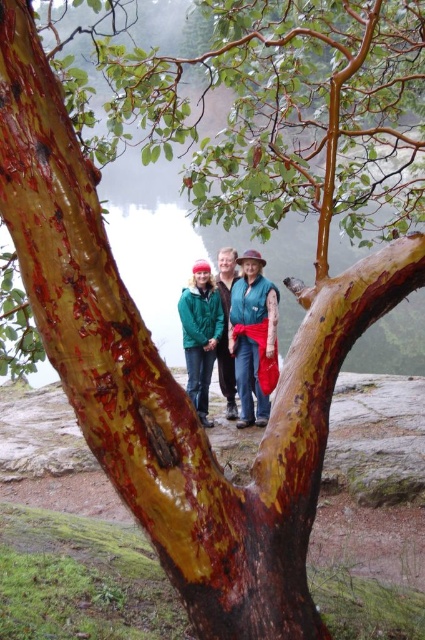
Is green fleece jacket at center below green matte jacket at center?

Incorrect, green fleece jacket at center is not positioned below green matte jacket at center.

Can you confirm if green fleece jacket at center is positioned to the left of green matte jacket at center?

In fact, green fleece jacket at center is to the right of green matte jacket at center.

Locate an element on the screen. green fleece jacket at center is located at coordinates (252, 337).

Is green fleece jacket at center above teal fabric vest at center?

Yes, green fleece jacket at center is above teal fabric vest at center.

What do you see at coordinates (252, 337) in the screenshot?
I see `green fleece jacket at center` at bounding box center [252, 337].

The image size is (425, 640). Describe the element at coordinates (252, 337) in the screenshot. I see `green fleece jacket at center` at that location.

You are a GUI agent. You are given a task and a screenshot of the screen. Output one action in this format:
    pyautogui.click(x=<x>, y=<y>)
    Task: Click on the green fleece jacket at center
    
    Given the screenshot: What is the action you would take?
    pyautogui.click(x=252, y=337)

Between point (243, 413) and point (215, 339), which one is positioned behind?

Point (215, 339)

Does teal fabric vest at center appear under green matte jacket at center?

No, teal fabric vest at center is not below green matte jacket at center.

This screenshot has width=425, height=640. Identify the location of teal fabric vest at center. (254, 337).